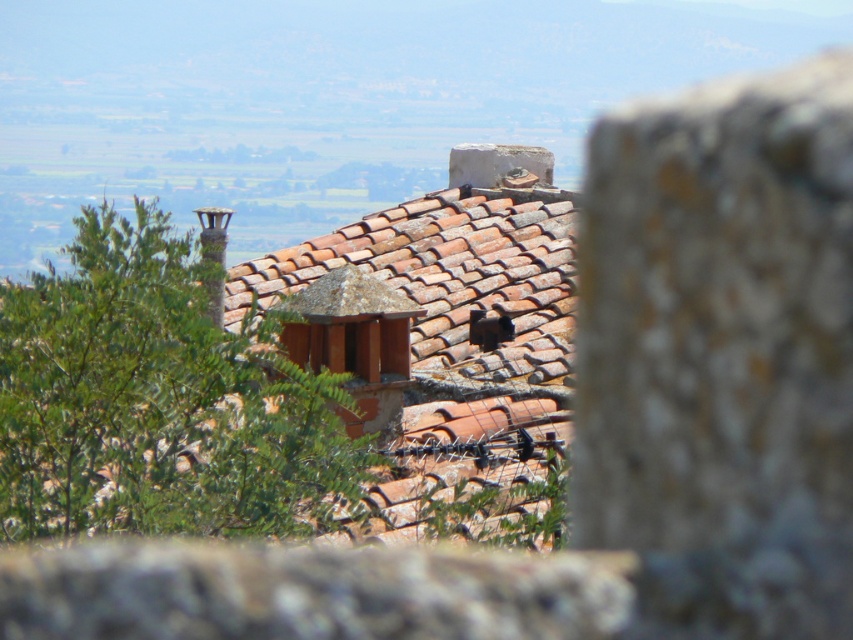
Who is more forward, (297, 500) or (505, 173)?

Point (297, 500) is in front.

At what (x,y) coordinates should I click in order to perform the action: click on green leafy tree at left. Please return your answer as a coordinate pair (x, y). Looking at the image, I should click on (157, 401).

Can you confirm if green leafy tree at left is positioned below terracotta tiles at center?

Yes, green leafy tree at left is below terracotta tiles at center.

Is point (129, 504) positioned in front of point (364, 404)?

Yes, it is in front of point (364, 404).

I want to click on green leafy tree at left, so click(157, 401).

Does terracotta tiles at center appear under white stone at center?

Yes, terracotta tiles at center is below white stone at center.

Does point (381, 358) come farther from viewer compared to point (473, 182)?

No.

Between point (555, 508) and point (491, 180), which one is positioned in front?

Point (555, 508)

Locate an element on the screen. This screenshot has height=640, width=853. terracotta tiles at center is located at coordinates (444, 353).